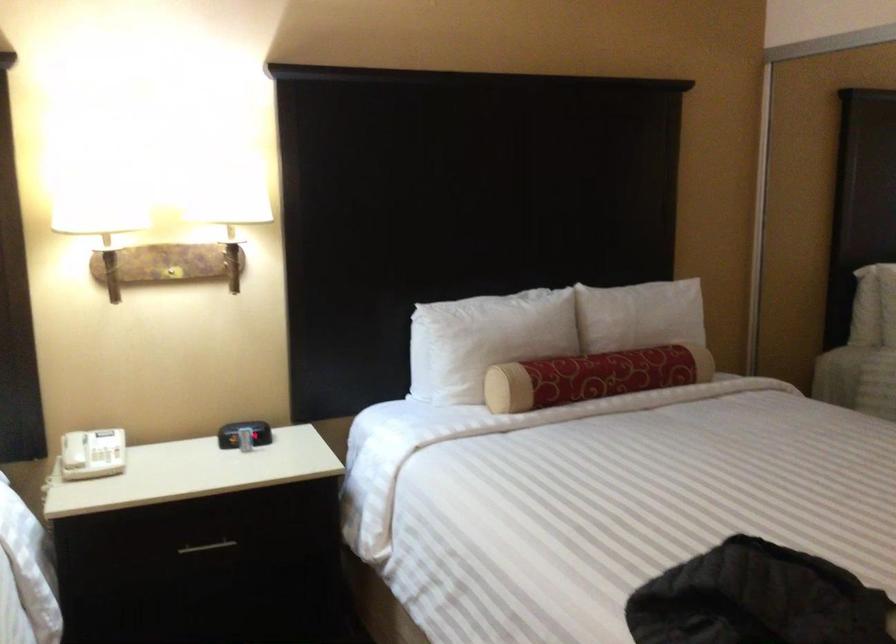
Where would you lift the white telephone handset? Please return your answer as a coordinate pair (x, y).

(73, 450)